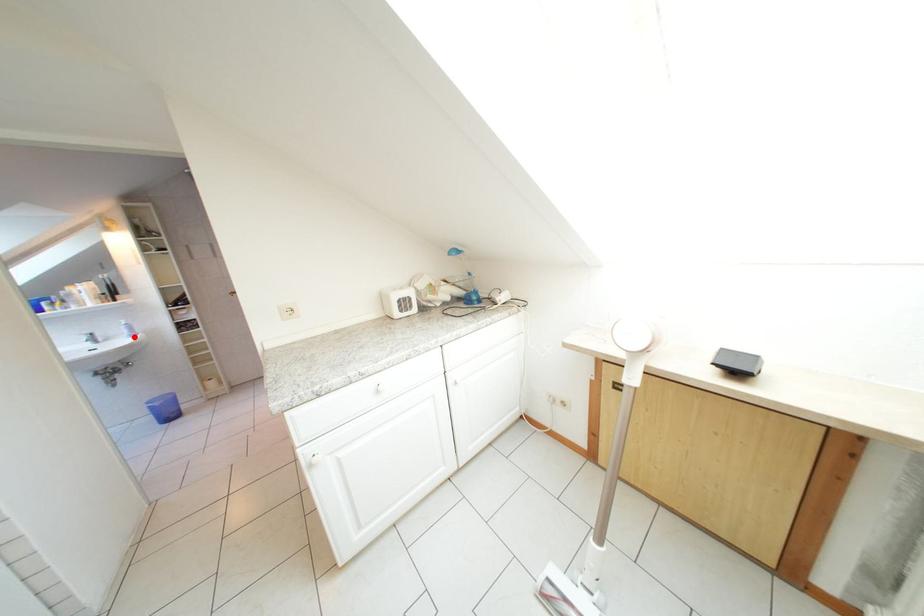
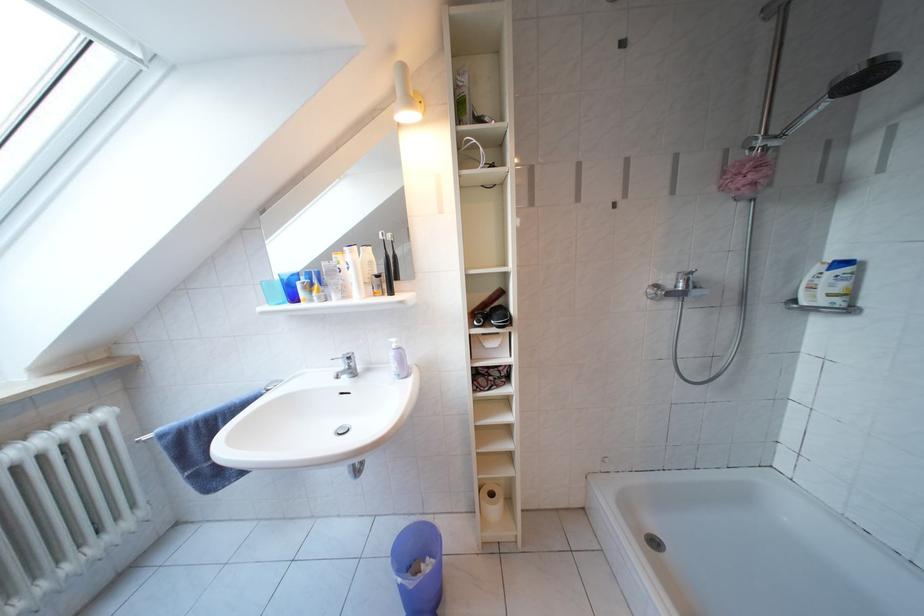
In the second image, find the point that corresponds to the highlighted location in the first image.

(402, 371)